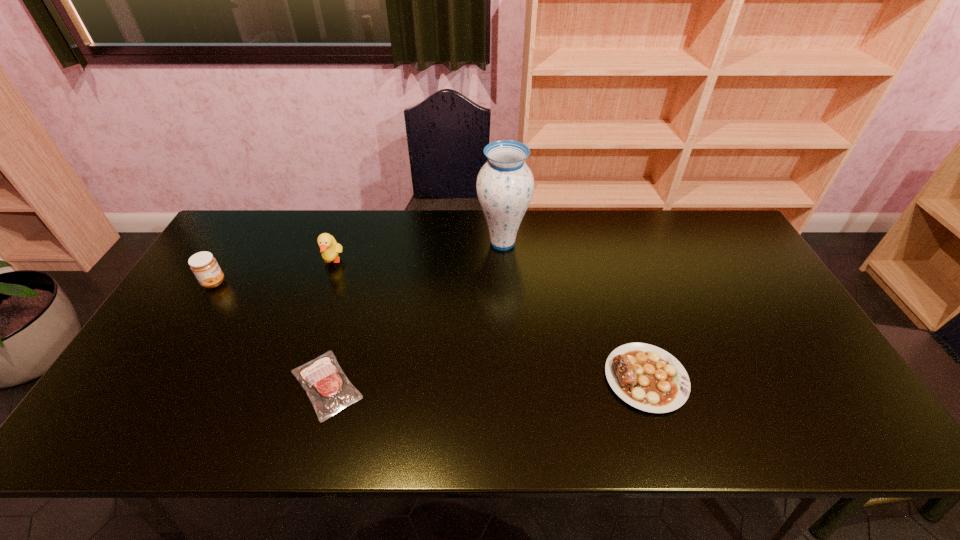
Where is `free space at the right edge`? free space at the right edge is located at coordinates (790, 329).

Where is `vacant region at the far right corner`? This screenshot has width=960, height=540. vacant region at the far right corner is located at coordinates click(x=695, y=226).

Where is `vacant region between the shorter steak and the third farthest object`? This screenshot has height=540, width=960. vacant region between the shorter steak and the third farthest object is located at coordinates (270, 334).

Find the location of a particular element. The image size is (960, 540). vacant point located between the shorter steak and the duckling is located at coordinates (329, 323).

Find the location of a particular element. The image size is (960, 540). free spot between the vase and the fourth tallest object is located at coordinates 574,310.

This screenshot has width=960, height=540. Find the location of `unoccupied position between the leftmost object and the duckling`. unoccupied position between the leftmost object and the duckling is located at coordinates (274, 272).

This screenshot has width=960, height=540. Find the location of `vacant area that lies between the duckling and the shortest object`. vacant area that lies between the duckling and the shortest object is located at coordinates (329, 323).

Identify the location of vacant area that lies between the rightmost object and the duckling. Image resolution: width=960 pixels, height=540 pixels. (490, 320).

This screenshot has height=540, width=960. What are the coordinates of `free space between the shortest object and the jam` in the screenshot? It's located at (270, 334).

Where is `unoccupied position between the duckling and the rightmost object`? The width and height of the screenshot is (960, 540). unoccupied position between the duckling and the rightmost object is located at coordinates (490, 320).